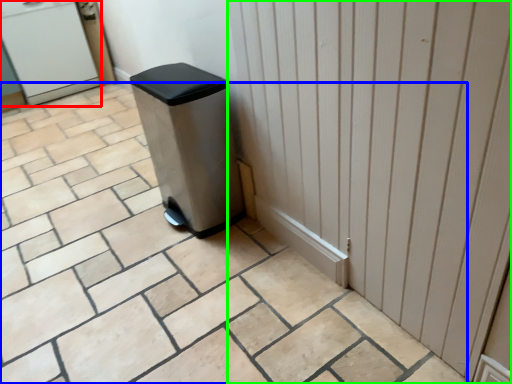
Question: Which is nearer to the water cooler (highlighted by a red box)? ceramic tile (highlighted by a blue box) or door (highlighted by a green box).

Choices:
 (A) ceramic tile
 (B) door

Answer: (A)